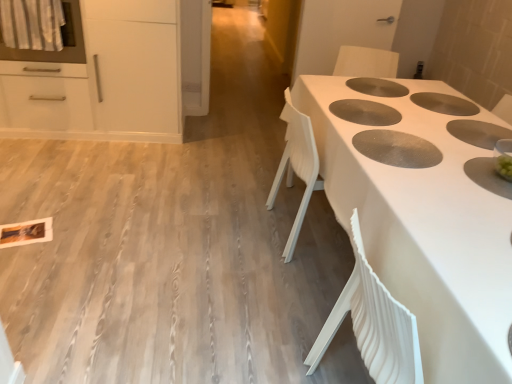
Question: From the image's perspective, is white plastic chair at center above or below white glossy oven at upper left?

Choices:
 (A) above
 (B) below

Answer: (B)

Question: Relative to white glossy oven at upper left, is white plastic chair at center in front or behind?

Choices:
 (A) front
 (B) behind

Answer: (A)

Question: Considering the real-world distances, which object is farthest from the white matte cabinet at upper left?

Choices:
 (A) white plastic chair at center
 (B) white textured table at center
 (C) white glossy oven at upper left

Answer: (B)

Question: Which object is positioned farthest from the white glossy oven at upper left?

Choices:
 (A) white matte cabinet at upper left
 (B) white plastic chair at center
 (C) white textured table at center

Answer: (C)